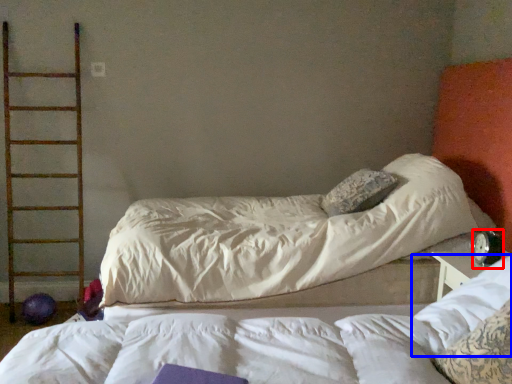
Question: Which object appears closest to the camera in this image, alarm clock (highlighted by a red box) or pillow (highlighted by a blue box)?

Choices:
 (A) alarm clock
 (B) pillow

Answer: (B)